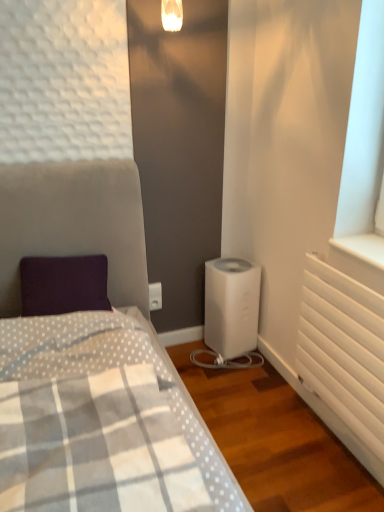
Question: In terms of size, does white matte radiator at right appear bigger or smaller than white plastic water heater at lower center?

Choices:
 (A) small
 (B) big

Answer: (A)

Question: Is white matte radiator at right spatially inside white plastic water heater at lower center, or outside of it?

Choices:
 (A) outside
 (B) inside

Answer: (A)

Question: Which object is positioned farthest from the white matte radiator at right?

Choices:
 (A) white plastic water heater at lower center
 (B) white plastic electric outlet at center

Answer: (B)

Question: Which object is the closest to the white matte radiator at right?

Choices:
 (A) white plastic electric outlet at center
 (B) white plastic water heater at lower center

Answer: (B)